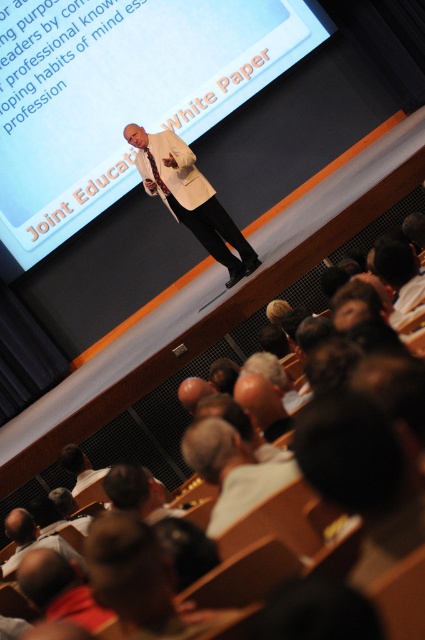
Who is more distant from viewer, [229,474] or [79,472]?

The point [79,472] is behind.

Does point (204, 458) lie behind point (85, 470)?

No, it is not.

Where is `white matte shirt at center`? Image resolution: width=425 pixels, height=640 pixels. white matte shirt at center is located at coordinates (232, 470).

Find the location of a particular element. white paper at upper center is located at coordinates (121, 93).

Between white paper at upper center and white matte shirt at lower left, which one has more height?

white paper at upper center is taller.

Which is behind, point (104, 32) or point (62, 465)?

The point (104, 32) is more distant.

I want to click on white paper at upper center, so click(121, 93).

Is white matte jacket at center bigger than white matte shirt at lower left?

Indeed, white matte jacket at center has a larger size compared to white matte shirt at lower left.

Consider the image. Is white matte jacket at center further to camera compared to white matte shirt at lower left?

That is True.

The height and width of the screenshot is (640, 425). Describe the element at coordinates (190, 196) in the screenshot. I see `white matte jacket at center` at that location.

Locate an element on the screen. The image size is (425, 640). white matte jacket at center is located at coordinates (190, 196).